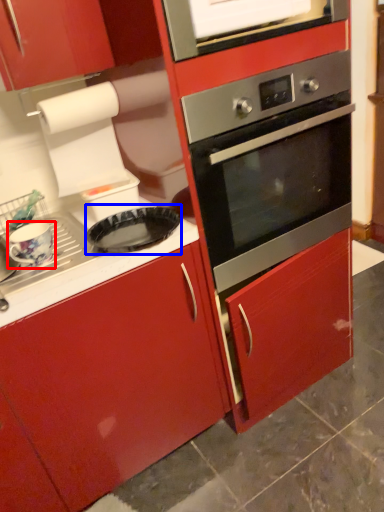
Question: Which object is further to the camera taking this photo, appliance (highlighted by a red box) or pizza pan (highlighted by a blue box)?

Choices:
 (A) appliance
 (B) pizza pan

Answer: (A)